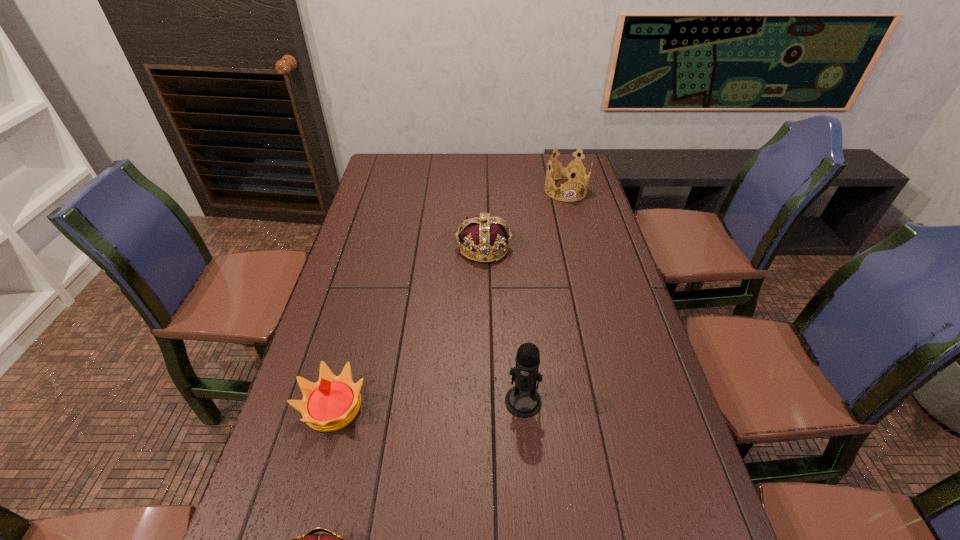
This screenshot has width=960, height=540. What are the coordinates of `microphone` in the screenshot? It's located at (522, 400).

The height and width of the screenshot is (540, 960). I want to click on the farthest object, so click(x=568, y=172).

Find the location of a particular element. the farthest crown is located at coordinates (568, 172).

The height and width of the screenshot is (540, 960). I want to click on the second farthest crown, so click(x=486, y=235).

Locate an element on the screen. The height and width of the screenshot is (540, 960). the second farthest object is located at coordinates (486, 235).

The width and height of the screenshot is (960, 540). Find the location of `the third tallest crown`. the third tallest crown is located at coordinates (330, 404).

This screenshot has width=960, height=540. I want to click on the third farthest crown, so click(330, 404).

You are a GUI agent. You are given a task and a screenshot of the screen. Output one action in this format:
    pyautogui.click(x=<x>, y=<y>)
    Task: Click on the vacant space located on the back of the microphone
    
    Given the screenshot: What is the action you would take?
    pyautogui.click(x=519, y=361)

The height and width of the screenshot is (540, 960). Find the location of `vacant space situated on the front of the rightmost object`. vacant space situated on the front of the rightmost object is located at coordinates (583, 253).

This screenshot has height=540, width=960. Find the location of `free space located 0.240m on the left of the fourth nearest object`. free space located 0.240m on the left of the fourth nearest object is located at coordinates (383, 248).